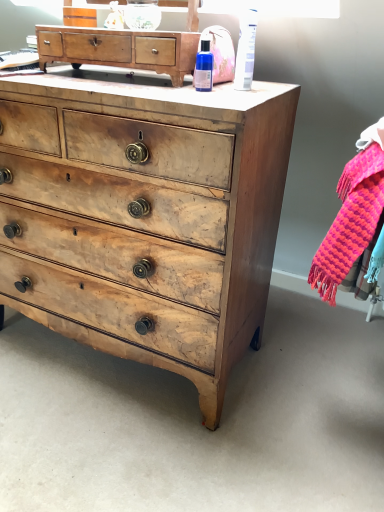
Question: Would you say knitted wool scarf at right is inside or outside wooden chest of drawers at upper center, which is counted as the first chest of drawers, starting from the top?

Choices:
 (A) inside
 (B) outside

Answer: (B)

Question: Is knitted wool scarf at right bigger or smaller than wooden chest of drawers at upper center, which is counted as the first chest of drawers, starting from the top?

Choices:
 (A) big
 (B) small

Answer: (A)

Question: Which of these objects is positioned farthest from the wooden chest of drawers at upper center, the second chest of drawers from the bottom?

Choices:
 (A) white plastic tube at upper right, the first toiletry positioned from the right
 (B) knitted wool scarf at right
 (C) blue glass bottle at upper center, acting as the 2th toiletry starting from the right
 (D) wooden chest of drawers at center, which is the 2th chest of drawers from top to bottom

Answer: (B)

Question: Considering the real-world distances, which object is closest to the wooden chest of drawers at upper center, which is counted as the first chest of drawers, starting from the top?

Choices:
 (A) blue glass bottle at upper center, acting as the 2th toiletry starting from the right
 (B) knitted wool scarf at right
 (C) white plastic tube at upper right, arranged as the 2th toiletry when viewed from the left
 (D) wooden chest of drawers at center, which is the 2th chest of drawers from top to bottom

Answer: (A)